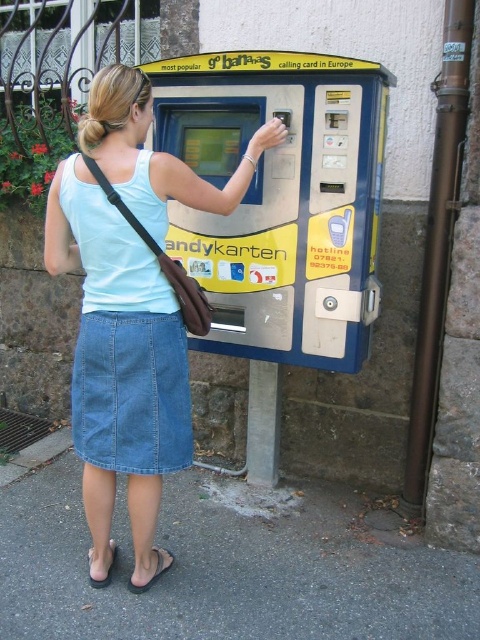
Question: Which point is closer to the camera?

Choices:
 (A) (269, 262)
 (B) (91, 401)
 (C) (109, 236)

Answer: (C)

Question: Which of these objects is positioned farthest from the yellow plastic vending machine at center?

Choices:
 (A) denim skirt at center
 (B) denim skirt at lower left

Answer: (B)

Question: Does yellow plastic vending machine at center appear over denim skirt at lower left?

Choices:
 (A) yes
 (B) no

Answer: (A)

Question: Where is yellow plastic vending machine at center located in relation to denim skirt at center in the image?

Choices:
 (A) below
 (B) above

Answer: (B)

Question: Does yellow plastic vending machine at center appear under denim skirt at center?

Choices:
 (A) no
 (B) yes

Answer: (A)

Question: Considering the real-world distances, which object is farthest from the denim skirt at lower left?

Choices:
 (A) denim skirt at center
 (B) yellow plastic vending machine at center

Answer: (B)